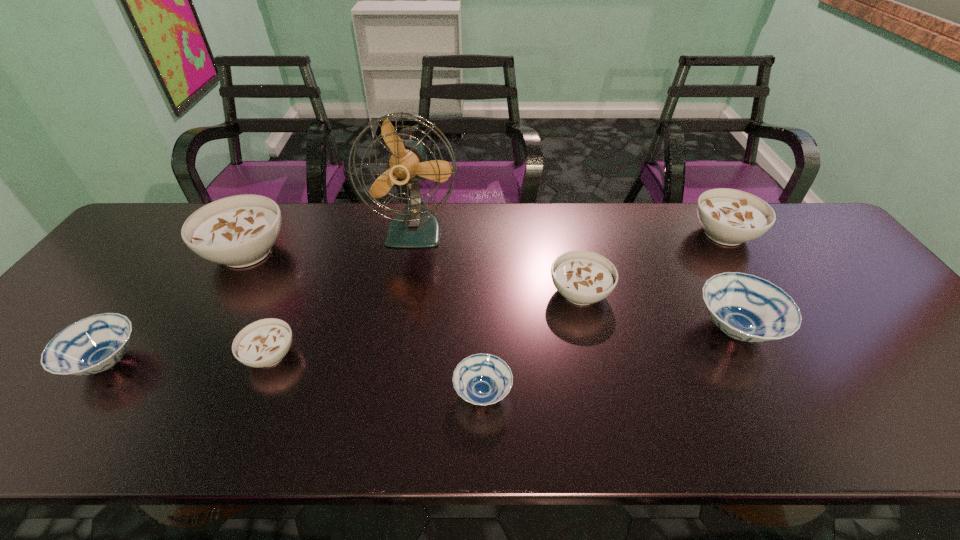
I want to click on blank space that satisfies the following two spatial constraints: 1. on the front side of the fifth soup bowl from left to right; 2. on the left side of the tallest soup bowl, so click(x=223, y=293).

You are a GUI agent. You are given a task and a screenshot of the screen. Output one action in this format:
    pyautogui.click(x=<x>, y=<y>)
    Task: Click on the free spot that satisfies the following two spatial constraints: 1. on the front-facing side of the second biggest white soup bowl for air flow; 2. on the left side of the fan
    Image resolution: width=960 pixels, height=540 pixels.
    Given the screenshot: What is the action you would take?
    pyautogui.click(x=415, y=234)